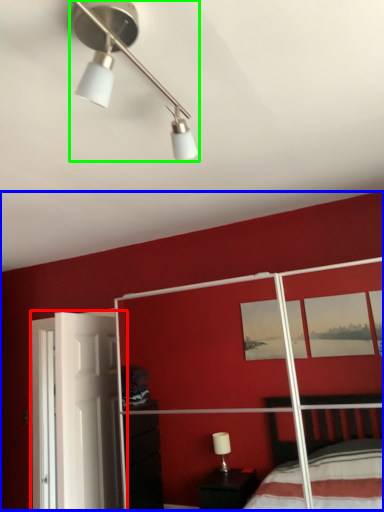
Question: Estimate the real-world distances between objects in this image. Which object is closer to screen door (highlighted by a red box), backdrop (highlighted by a blue box) or lamp (highlighted by a green box)?

Choices:
 (A) backdrop
 (B) lamp

Answer: (A)